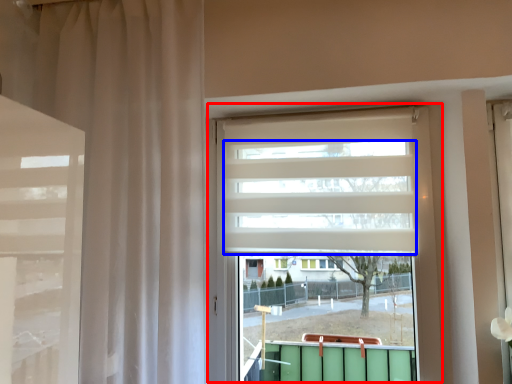
Question: Which object appears closest to the camera in this image, window (highlighted by a red box) or blind (highlighted by a blue box)?

Choices:
 (A) window
 (B) blind

Answer: (A)